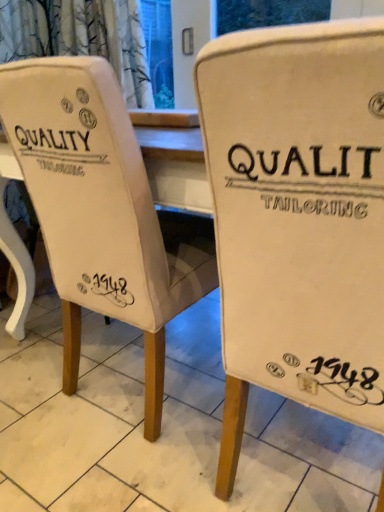
I want to click on vacant space that is in between beige fabric chair at center, the first chair from the right, and white fabric chair at center, the second chair viewed from the right, so click(154, 455).